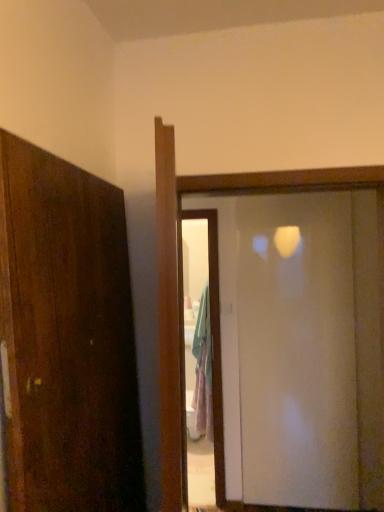
Find the location of `transparent glass screen door at center`. transparent glass screen door at center is located at coordinates (296, 352).

The height and width of the screenshot is (512, 384). What do you see at coordinates (296, 352) in the screenshot?
I see `transparent glass screen door at center` at bounding box center [296, 352].

In order to face transparent glass screen door at center, should I rotate leftwards or rightwards?

Rotate your view right by about 12.874°.

The height and width of the screenshot is (512, 384). What do you see at coordinates (182, 270) in the screenshot? I see `transparent glass door at center` at bounding box center [182, 270].

You are a GUI agent. You are given a task and a screenshot of the screen. Output one action in this format:
    pyautogui.click(x=<x>, y=<y>)
    Task: Click on the transparent glass door at center
    The width and height of the screenshot is (384, 512).
    Given the screenshot: What is the action you would take?
    pyautogui.click(x=182, y=270)

The width and height of the screenshot is (384, 512). Identify the location of transparent glass screen door at center. (296, 352).

Is transparent glass door at center to the right of transparent glass screen door at center from the viewer's perspective?

In fact, transparent glass door at center is to the left of transparent glass screen door at center.

Which object is further away from the camera, transparent glass door at center or transparent glass screen door at center?

transparent glass screen door at center is further away from the camera.

Is point (256, 506) closer or farther from the camera than point (299, 253)?

Clearly, point (256, 506) is more distant from the camera than point (299, 253).

From the image's perspective, which one is positioned higher, transparent glass door at center or transparent glass screen door at center?

transparent glass door at center, from the image's perspective.

From a real-world perspective, which object rests below the other?

transparent glass screen door at center is physically lower.

Looking at their sizes, would you say transparent glass door at center is wider or thinner than transparent glass screen door at center?

Clearly, transparent glass door at center has more width compared to transparent glass screen door at center.

Which of these two, transparent glass door at center or transparent glass screen door at center, stands taller?

transparent glass screen door at center.

Is transparent glass door at center bigger or smaller than transparent glass screen door at center?

transparent glass door at center is bigger than transparent glass screen door at center.

Is transparent glass screen door at center inside transparent glass door at center?

No.

Is transparent glass door at center beside transparent glass screen door at center?

No, transparent glass door at center is not beside transparent glass screen door at center.

Could you tell me if transparent glass door at center is facing transparent glass screen door at center?

No, transparent glass door at center is not turned towards transparent glass screen door at center.

Can you tell me how much transparent glass door at center and transparent glass screen door at center differ in facing direction?

They differ by 2.55 degrees in their facing directions.

The image size is (384, 512). What are the coordinates of `screen door on the right of transparent glass door at center` in the screenshot? It's located at (296, 352).

Considering the positions of objects transparent glass screen door at center and transparent glass door at center in the image provided, who is more to the left, transparent glass screen door at center or transparent glass door at center?

transparent glass door at center.

Who is more distant, transparent glass screen door at center or transparent glass door at center?

transparent glass screen door at center is behind.

Between point (351, 224) and point (328, 181), which one is positioned behind?

The point (351, 224) is behind.

From the image's perspective, which is below, transparent glass screen door at center or transparent glass door at center?

transparent glass screen door at center.

From a real-world perspective, is transparent glass screen door at center below transparent glass door at center?

Correct, in the physical world, transparent glass screen door at center is lower than transparent glass door at center.

Looking at this image, in terms of width, does transparent glass screen door at center look wider or thinner when compared to transparent glass door at center?

Considering their sizes, transparent glass screen door at center looks slimmer than transparent glass door at center.

Is transparent glass screen door at center shorter than transparent glass door at center?

No, transparent glass screen door at center is not shorter than transparent glass door at center.

Which of these two, transparent glass screen door at center or transparent glass door at center, is smaller?

transparent glass screen door at center is smaller.

Could transparent glass door at center be considered to be inside transparent glass screen door at center?

No, transparent glass door at center is not a part of transparent glass screen door at center.

Are transparent glass screen door at center and transparent glass door at center located far from each other?

That's right, there is a large distance between transparent glass screen door at center and transparent glass door at center.

Is transparent glass screen door at center oriented towards transparent glass door at center?

Yes, transparent glass screen door at center is turned towards transparent glass door at center.

This screenshot has height=512, width=384. Identify the location of screen door that appears below the transparent glass door at center (from a real-world perspective). (296, 352).

The height and width of the screenshot is (512, 384). I want to click on door in front of the transparent glass screen door at center, so click(x=182, y=270).

The width and height of the screenshot is (384, 512). Find the location of `door on the left of transparent glass screen door at center`. door on the left of transparent glass screen door at center is located at coordinates (182, 270).